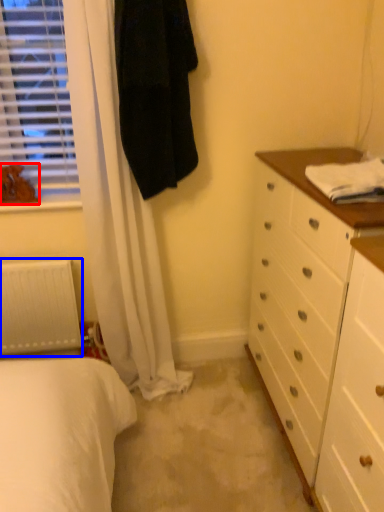
Question: Which object appears closest to the camera in this image, animal (highlighted by a red box) or radiator (highlighted by a blue box)?

Choices:
 (A) animal
 (B) radiator

Answer: (A)